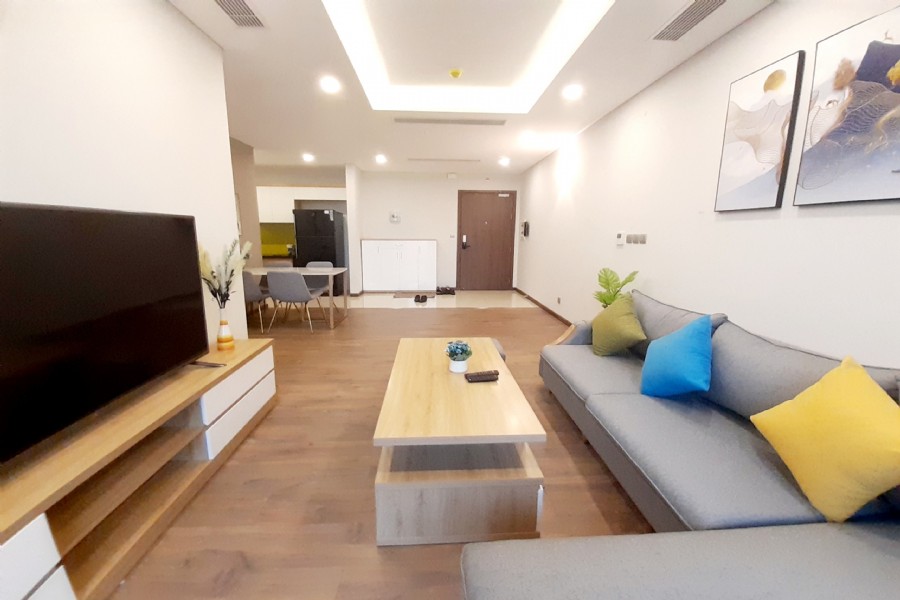
This screenshot has height=600, width=900. Identify the location of blue pillow. (684, 374).